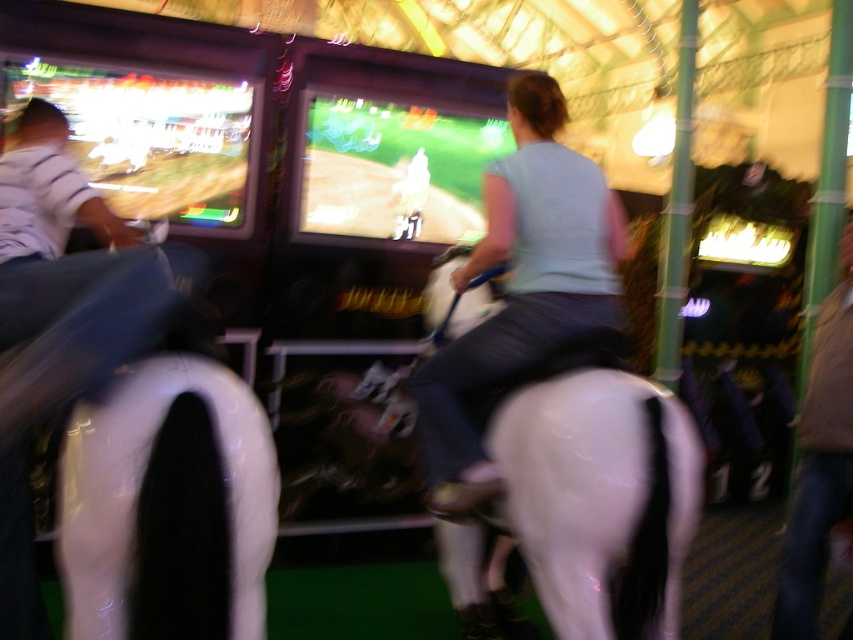
Who is positioned more to the right, white glossy horse at center or brown leather jacket at lower right?

brown leather jacket at lower right is more to the right.

Who is positioned more to the left, white glossy horse at center or brown leather jacket at lower right?

Positioned to the left is white glossy horse at center.

Image resolution: width=853 pixels, height=640 pixels. What are the coordinates of `white glossy horse at center` in the screenshot? It's located at (598, 497).

Locate an element on the screen. white glossy horse at center is located at coordinates (598, 497).

Does white glossy horse at center lie behind light blue fabric at center?

No.

Which is above, white glossy horse at center or light blue fabric at center?

light blue fabric at center

Is point (524, 513) closer to viewer compared to point (529, 307)?

Yes.

Where is `white glossy horse at center`? This screenshot has height=640, width=853. white glossy horse at center is located at coordinates (598, 497).

Who is more forward, [433,429] or [805,552]?

Positioned in front is point [433,429].

Is light blue fabric at center positioned in front of brown leather jacket at lower right?

Yes, light blue fabric at center is closer to the viewer.

Is point (428, 454) more distant than point (785, 531)?

No, it is not.

You are a GUI agent. You are given a task and a screenshot of the screen. Output one action in this format:
    pyautogui.click(x=<x>, y=<y>)
    Task: Click on the light blue fabric at center
    The width and height of the screenshot is (853, 640).
    Given the screenshot: What is the action you would take?
    click(521, 285)